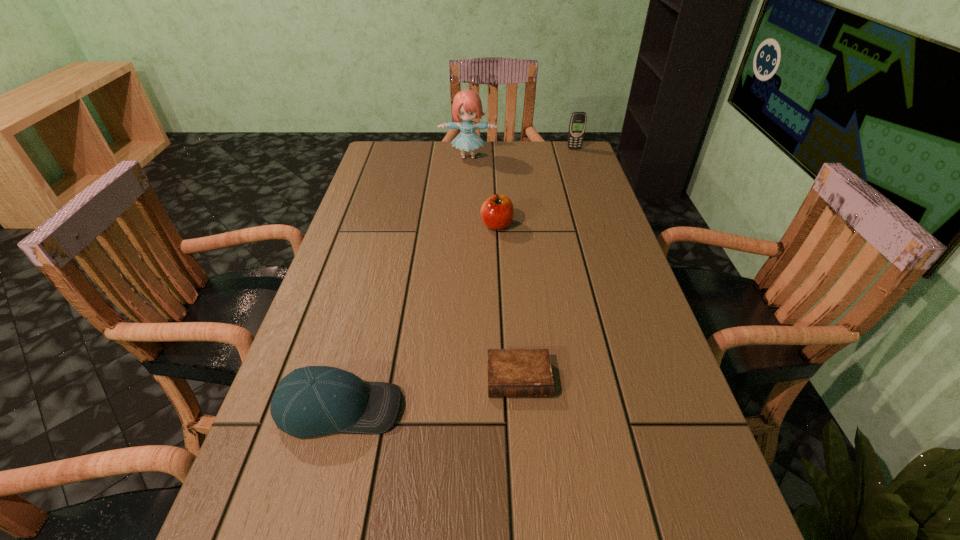
At what (x,y) coordinates should I click in order to perform the action: click on free space at the far left corner of the desktop. Please return your answer as a coordinate pair (x, y). Looking at the image, I should click on (402, 167).

You are a GUI agent. You are given a task and a screenshot of the screen. Output one action in this format:
    pyautogui.click(x=<x>, y=<y>)
    Task: Click on the vacant space at the far right corner of the desktop
    
    Given the screenshot: What is the action you would take?
    pyautogui.click(x=550, y=151)

Where is `empty space between the leftmost object and the doll`? The height and width of the screenshot is (540, 960). empty space between the leftmost object and the doll is located at coordinates (403, 282).

Where is `free space between the cellular telephone and the baseball cap`? free space between the cellular telephone and the baseball cap is located at coordinates (457, 279).

Identify the location of free space between the tallest object and the apple. The width and height of the screenshot is (960, 540). (483, 191).

Where is `free space between the doll and the leftmost object`? Image resolution: width=960 pixels, height=540 pixels. free space between the doll and the leftmost object is located at coordinates (403, 282).

Locate an element on the screen. Image resolution: width=960 pixels, height=540 pixels. free space between the shortest object and the fourth nearest object is located at coordinates (493, 268).

Locate an element on the screen. unoccupied area between the apple and the diary is located at coordinates (508, 302).

Locate an element on the screen. This screenshot has width=960, height=540. free space that is in between the baseball cap and the farthest object is located at coordinates (457, 279).

Locate an element on the screen. The height and width of the screenshot is (540, 960). empty location between the apple and the leftmost object is located at coordinates (418, 316).